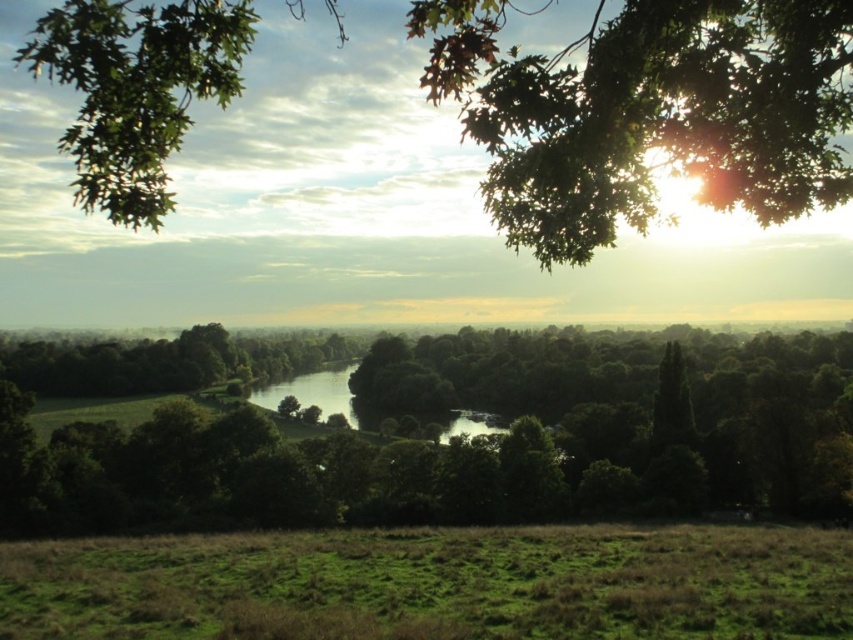
Question: Which object is closer to the camera taking this photo?

Choices:
 (A) green leafy tree at center
 (B) green leafy tree at upper center

Answer: (B)

Question: Can you confirm if green leafy tree at upper center is smaller than green grassy field at lower center?

Choices:
 (A) yes
 (B) no

Answer: (B)

Question: Is green leafy tree at center thinner than green leafy tree at upper center?

Choices:
 (A) yes
 (B) no

Answer: (B)

Question: Which point is closer to the camera?

Choices:
 (A) (757, 138)
 (B) (323, 568)
 (C) (221, 435)

Answer: (A)

Question: Which is farther from the green grassy field at lower center?

Choices:
 (A) green leafy tree at center
 (B) green leafy tree at upper center

Answer: (A)

Question: Observing the image, what is the correct spatial positioning of green leafy tree at center in reference to green grassy field at lower center?

Choices:
 (A) below
 (B) above

Answer: (A)